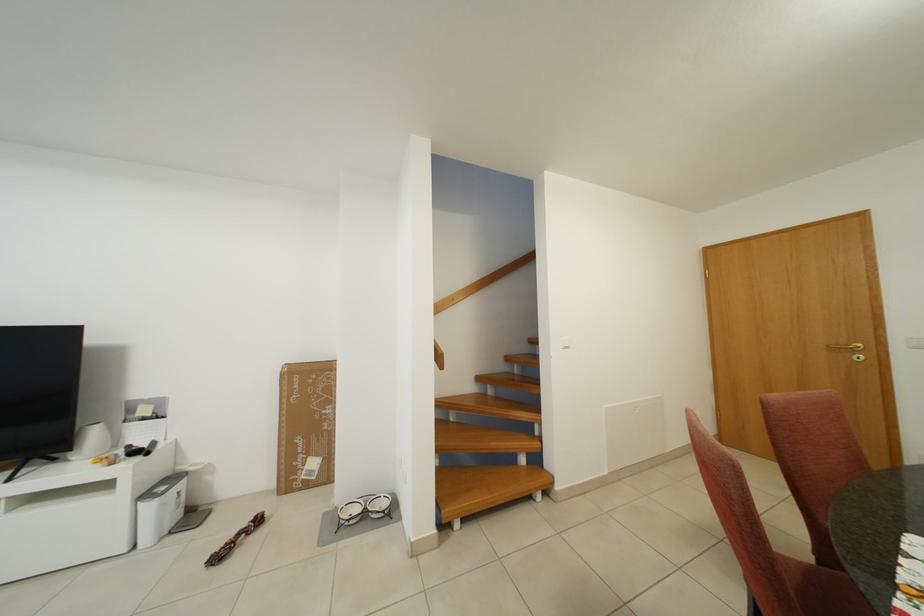
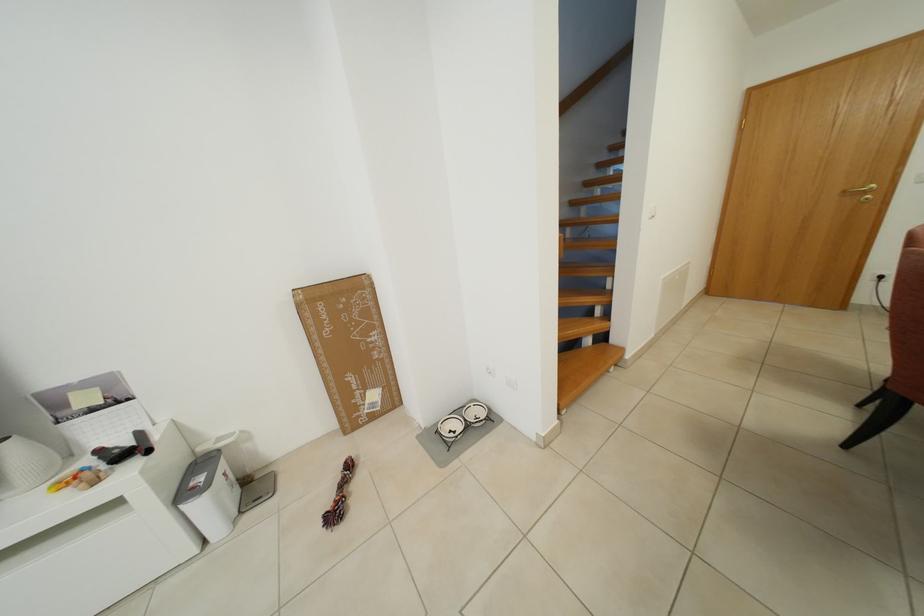
Question: Based on the continuous images, in which direction is the camera rotating? Reply with the corresponding letter.

Choices:
 (A) Left
 (B) Right
 (C) Up
 (D) Down

Answer: (D)